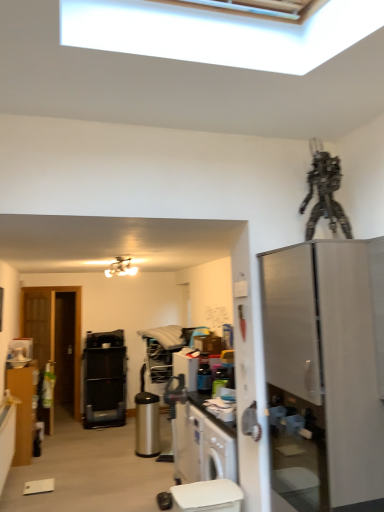
Where is `metallic robot at upper right`? metallic robot at upper right is located at coordinates (324, 191).

Identify the location of white glossy toilet bowl at lower center. (207, 496).

What do you see at coordinates (121, 267) in the screenshot? I see `white matte light fixture at upper center` at bounding box center [121, 267].

This screenshot has height=512, width=384. What do you see at coordinates (104, 379) in the screenshot? I see `black mesh speaker at center, which ranks as the 1th appliance in left-to-right order` at bounding box center [104, 379].

The width and height of the screenshot is (384, 512). Describe the element at coordinates (147, 425) in the screenshot. I see `polished stainless steel trash can at center, which is counted as the 2th appliance, starting from the front` at that location.

What are the coordinates of `transparent glass door at left` in the screenshot? It's located at (56, 337).

Considering the relative sizes of stainless steel refrigerator at right and transparent glass door at left in the image provided, is stainless steel refrigerator at right smaller than transparent glass door at left?

No.

From a real-world perspective, which object rests below the other?

From a 3D spatial view, transparent glass door at left is below.

Is stainless steel refrigerator at right taller than transparent glass door at left?

Incorrect, the height of stainless steel refrigerator at right is not larger of that of transparent glass door at left.

Where is `refrigerator above the transparent glass door at left (from a real-world perspective)`? Image resolution: width=384 pixels, height=512 pixels. refrigerator above the transparent glass door at left (from a real-world perspective) is located at coordinates (325, 373).

Consider the image. Which of these two, stainless steel refrigerator at right or metallic robot at upper right, stands taller?

stainless steel refrigerator at right is taller.

Is stainless steel refrigerator at right not close to metallic robot at upper right?

No, there isn't a large distance between stainless steel refrigerator at right and metallic robot at upper right.

How different are the orientations of stainless steel refrigerator at right and metallic robot at upper right in degrees?

The angular difference between stainless steel refrigerator at right and metallic robot at upper right is 4.27 degrees.

Is stainless steel refrigerator at right spatially inside metallic robot at upper right, or outside of it?

stainless steel refrigerator at right cannot be found inside metallic robot at upper right.

Is metallic silver toaster at center, which is counted as the third appliance, starting from the left, to the left or to the right of white glossy toilet bowl at lower center in the image?

metallic silver toaster at center, which is counted as the third appliance, starting from the left, is positioned on white glossy toilet bowl at lower center's right side.

In the image, there is a metallic silver toaster at center, which is counted as the third appliance, starting from the left. Identify the location of toilet bowl below it (from a real-world perspective). (207, 496).

Is white glossy toilet bowl at lower center a part of metallic silver toaster at center, marked as the 1th appliance in a right-to-left arrangement?

No, white glossy toilet bowl at lower center is located outside of metallic silver toaster at center, marked as the 1th appliance in a right-to-left arrangement.

Considering the sizes of metallic silver toaster at center, which is counted as the 3th appliance, starting from the back, and white glossy toilet bowl at lower center in the image, is metallic silver toaster at center, which is counted as the 3th appliance, starting from the back, bigger or smaller than white glossy toilet bowl at lower center?

Clearly, metallic silver toaster at center, which is counted as the 3th appliance, starting from the back, is smaller in size than white glossy toilet bowl at lower center.

Are stainless steel refrigerator at right and white glossy toilet bowl at lower center beside each other?

They are not placed beside each other.

Is stainless steel refrigerator at right wider or thinner than white glossy toilet bowl at lower center?

In the image, stainless steel refrigerator at right appears to be wider than white glossy toilet bowl at lower center.

Is white glossy toilet bowl at lower center a part of stainless steel refrigerator at right?

Actually, white glossy toilet bowl at lower center is outside stainless steel refrigerator at right.

From a real-world perspective, between stainless steel refrigerator at right and white glossy toilet bowl at lower center, who is vertically higher?

stainless steel refrigerator at right.

From the image's perspective, is metallic silver toaster at center, placed as the 1th appliance when sorted from front to back, located above or below transparent glass door at left?

From the image's perspective, metallic silver toaster at center, placed as the 1th appliance when sorted from front to back, appears above transparent glass door at left.

In the image, is metallic silver toaster at center, which is counted as the 3th appliance, starting from the back, on the left side or the right side of transparent glass door at left?

Based on their positions, metallic silver toaster at center, which is counted as the 3th appliance, starting from the back, is located to the right of transparent glass door at left.

Could you tell me if metallic silver toaster at center, marked as the 1th appliance in a right-to-left arrangement, is facing transparent glass door at left?

No, metallic silver toaster at center, marked as the 1th appliance in a right-to-left arrangement, is not aimed at transparent glass door at left.

From the image's perspective, is transparent glass door at left above or below metallic robot at upper right?

Clearly, from the image's perspective, transparent glass door at left is below metallic robot at upper right.

From a real-world perspective, relative to metallic robot at upper right, is transparent glass door at left vertically above or below?

From a real-world perspective, transparent glass door at left is physically below metallic robot at upper right.

Which is behind, transparent glass door at left or metallic robot at upper right?

transparent glass door at left is behind.

From a real-world perspective, who is located lower, stainless steel refrigerator at right or black mesh speaker at center, which is counted as the first appliance, starting from the back?

From a 3D spatial view, black mesh speaker at center, which is counted as the first appliance, starting from the back, is below.

From the image's perspective, between stainless steel refrigerator at right and black mesh speaker at center, which is the 3th appliance in front-to-back order, which one is located above?

stainless steel refrigerator at right appears higher in the image.

Is point (299, 432) positioned behind point (107, 337)?

No, (299, 432) is closer to viewer.

Between stainless steel refrigerator at right and black mesh speaker at center, which is the 3th appliance in front-to-back order, which one has smaller width?

black mesh speaker at center, which is the 3th appliance in front-to-back order.

Locate an element on the screen. The width and height of the screenshot is (384, 512). refrigerator above the transparent glass door at left (from a real-world perspective) is located at coordinates (325, 373).

You are a GUI agent. You are given a task and a screenshot of the screen. Output one action in this format:
    pyautogui.click(x=<x>, y=<y>)
    Task: Click on the refrigerator that appears on the right of metallic robot at upper right
    
    Given the screenshot: What is the action you would take?
    pyautogui.click(x=325, y=373)

Looking at the image, which one is located further to white glossy toilet bowl at lower center, polished stainless steel trash can at center, the 2th appliance viewed from the right, or matte brown cabinet at left?

matte brown cabinet at left lies further to white glossy toilet bowl at lower center than the other object.

Which object lies nearer to the anchor point stainless steel refrigerator at right, metallic robot at upper right or metallic silver toaster at center, which is counted as the third appliance, starting from the left?

metallic robot at upper right lies closer to stainless steel refrigerator at right than the other object.

From the image, which object appears to be nearer to white glossy toilet bowl at lower center, polished stainless steel trash can at center, the 2th appliance viewed from the back, or metallic robot at upper right?

The object closer to white glossy toilet bowl at lower center is metallic robot at upper right.

Estimate the real-world distances between objects in this image. Which object is further from stainless steel refrigerator at right, metallic silver toaster at center, marked as the 1th appliance in a right-to-left arrangement, or matte brown cabinet at left?

matte brown cabinet at left is further to stainless steel refrigerator at right.

Looking at the image, which one is located closer to matte brown cabinet at left, transparent glass door at left or white glossy toilet bowl at lower center?

The object closer to matte brown cabinet at left is transparent glass door at left.

Considering their positions, is stainless steel refrigerator at right positioned closer to black mesh speaker at center, which is counted as the first appliance, starting from the back, than metallic silver toaster at center, which is counted as the third appliance, starting from the left?

The object closer to black mesh speaker at center, which is counted as the first appliance, starting from the back, is metallic silver toaster at center, which is counted as the third appliance, starting from the left.

Based on their spatial positions, is white glossy toilet bowl at lower center or metallic robot at upper right further from stainless steel refrigerator at right?

Among the two, white glossy toilet bowl at lower center is located further to stainless steel refrigerator at right.

When comparing their distances from black mesh speaker at center, which is counted as the first appliance, starting from the back, does white glossy toilet bowl at lower center or polished stainless steel trash can at center, which ranks as the 2th appliance in left-to-right order, seem further?

The object further to black mesh speaker at center, which is counted as the first appliance, starting from the back, is white glossy toilet bowl at lower center.

Image resolution: width=384 pixels, height=512 pixels. Identify the location of toilet bowl between metallic robot at upper right and transparent glass door at left in the front-back direction. (207, 496).

Identify the location of appliance between metallic silver toaster at center, which is counted as the 3th appliance, starting from the back, and black mesh speaker at center, which is the third appliance from right to left, from front to back. [x=147, y=425].

You are a GUI agent. You are given a task and a screenshot of the screen. Output one action in this format:
    pyautogui.click(x=<x>, y=<y>)
    Task: Click on the appliance located between white glossy toilet bowl at lower center and white matte light fixture at upper center in the depth direction
    
    Given the screenshot: What is the action you would take?
    pyautogui.click(x=204, y=377)

Locate an element on the screen. Image resolution: width=384 pixels, height=512 pixels. appliance between white glossy toilet bowl at lower center and polished stainless steel trash can at center, which ranks as the 2th appliance in left-to-right order, from front to back is located at coordinates (204, 377).